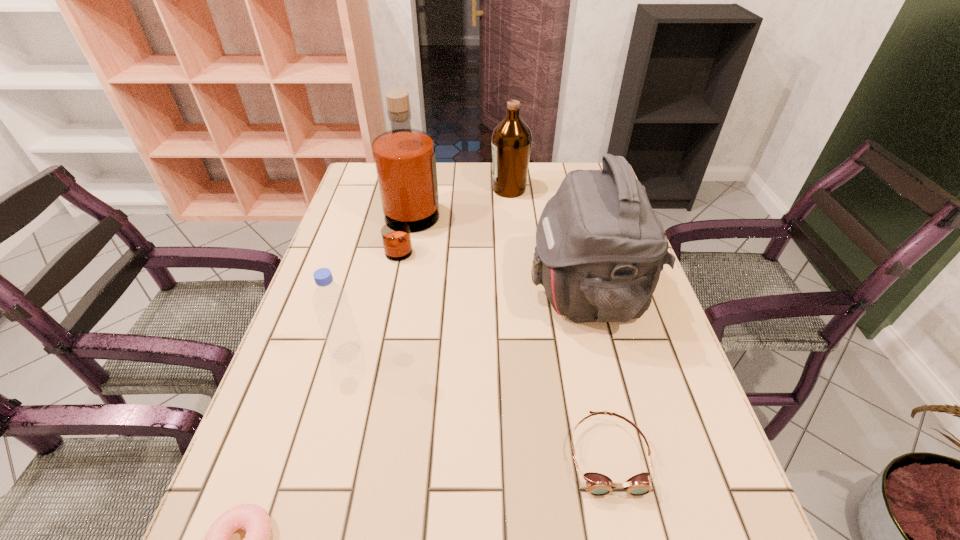
Find the location of a particular element. The height and width of the screenshot is (540, 960). free space at the far edge of the desktop is located at coordinates (472, 200).

This screenshot has height=540, width=960. In the image, there is a desktop. In order to click on vacant space at the left edge in this screenshot , I will do `click(342, 259)`.

Find the location of `free point between the third shortest object and the fifth tallest object`. free point between the third shortest object and the fifth tallest object is located at coordinates (478, 404).

Identify the location of free space between the goggles and the third shortest object. (478, 404).

This screenshot has height=540, width=960. I want to click on free area in between the shoulder bag and the fourth tallest object, so click(x=467, y=322).

Locate an element on the screen. This screenshot has height=540, width=960. free point between the olive oil and the fifth tallest object is located at coordinates (559, 322).

Find the location of a particular element. free space between the fifth tallest object and the shoulder bag is located at coordinates (597, 374).

Identify the location of free space between the fourth shortest object and the goggles. (559, 322).

Where is `the fifth closest object relative to the liquor`? This screenshot has height=540, width=960. the fifth closest object relative to the liquor is located at coordinates (254, 519).

Where is `object that is the closest to the nearest object`? Image resolution: width=960 pixels, height=540 pixels. object that is the closest to the nearest object is located at coordinates (330, 301).